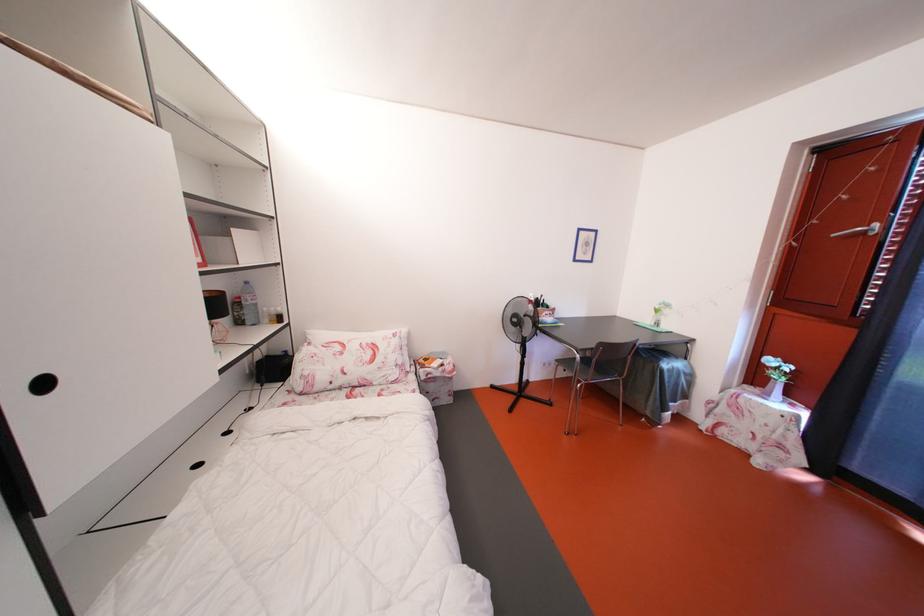
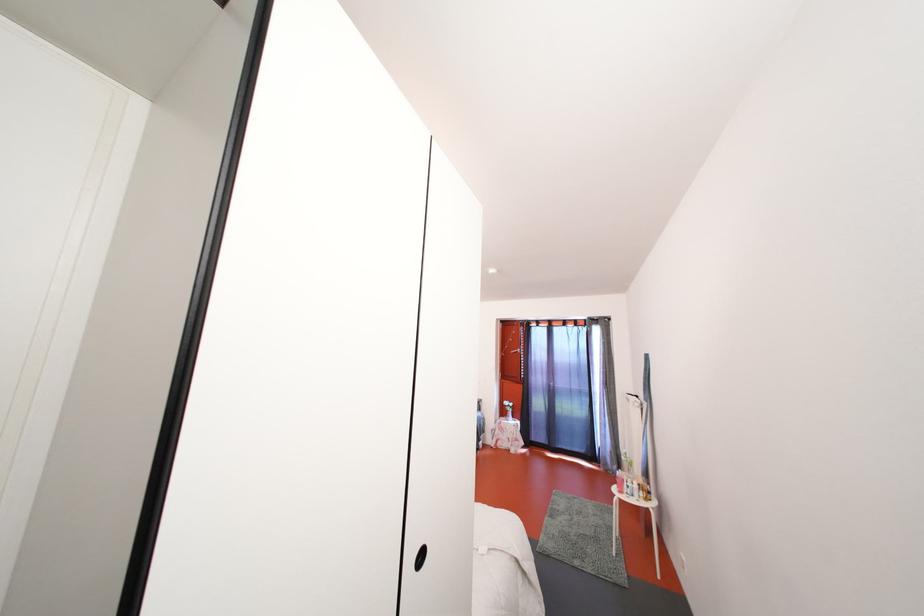
Locate, in the second image, the point that corresponds to (x=761, y=383) in the first image.

(509, 418)